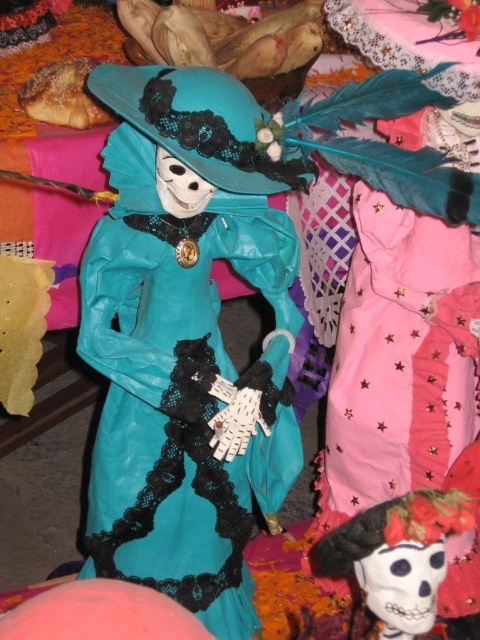
Based on the photo, please look at the image and find the point at coordinates (x=187, y=340). What object is located there?

The point at coordinates (x=187, y=340) corresponds to the matte teal dress at center.

You are a photographer standing 30 inches away from a display of festive decorations. You want to take a closeup photo of the matte teal dress at center. Can you move closer to get a better shot without exceeding the recommended minimum distance of 20 inches for sharp focus?

The matte teal dress at center is currently 22.46 inches away from the camera. Since the recommended minimum distance is 20 inches, you can move 2.46 inches closer to achieve the desired focus without going below the safe distance.

You are an artist creating a layout for a festival poster. You need to position the matte teal dress at center and the matte teal fabric skull at center in a way that follows the original image. Which object should be placed to the right side of the other?

The matte teal dress at center should be placed to the left of the matte teal fabric skull at center, so the matte teal fabric skull at center should be positioned to the right side of the matte teal dress at center.